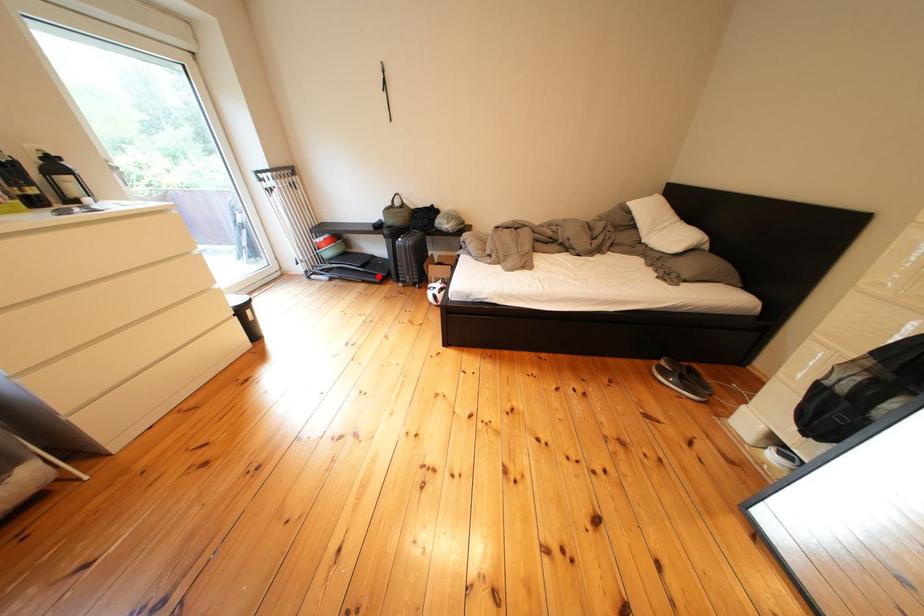
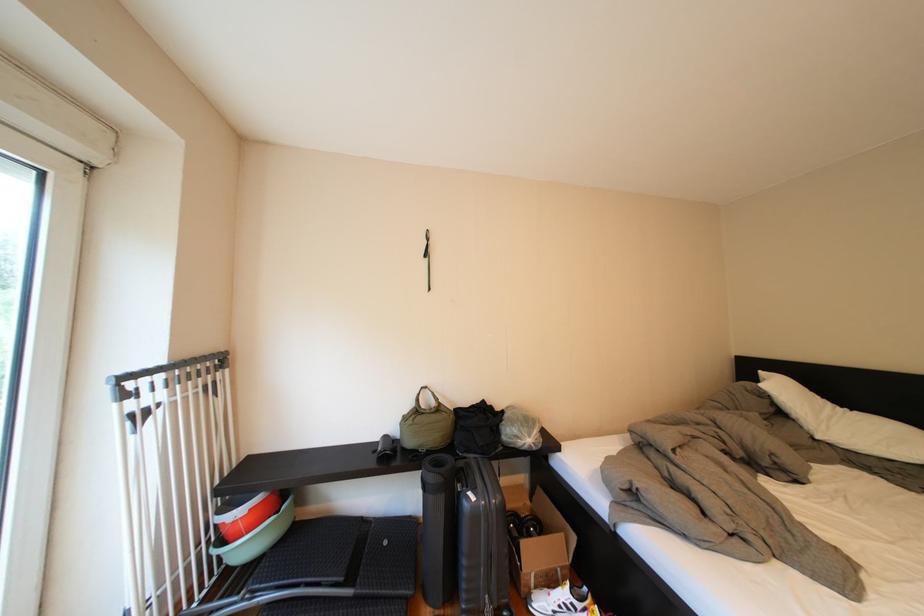
Question: I am providing you with two images of the same scene from different viewpoints. A red point is shown in image1. For the corresponding object point in image2, is it positioned nearer or farther from the camera?

Choices:
 (A) Nearer
 (B) Farther

Answer: (B)